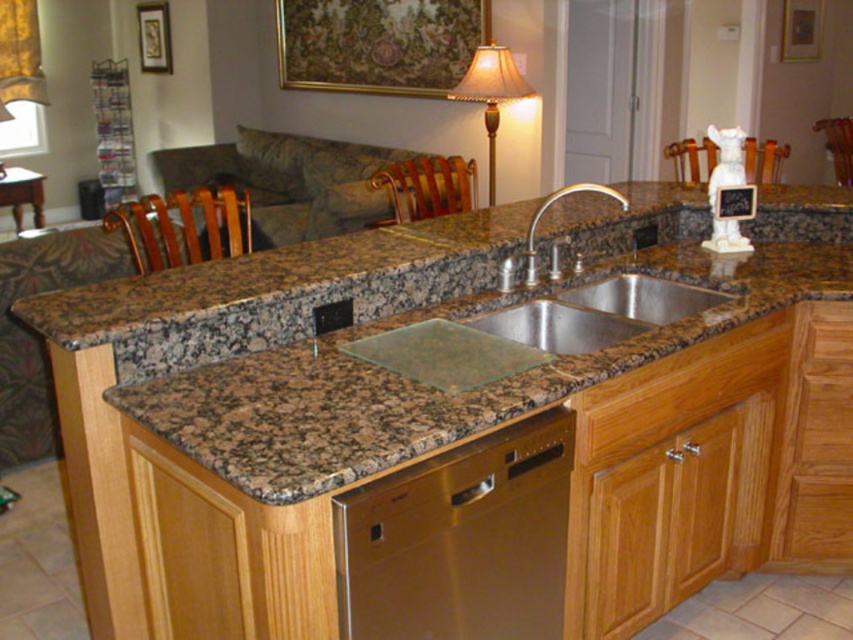
You are standing in the kitchen and want to reach both the stainless steel sink at center and the gold fabric lampshade at upper center. Which object will you need to move closer to first?

You will need to move closer to the stainless steel sink at center first because it is closer to you than the gold fabric lampshade at upper center.

You are standing in the kitchen and see the wooden chair at center and the gold fabric lampshade at upper center. Which object is nearer to you?

The wooden chair at center is closer to the viewer than the gold fabric lampshade at upper center.

You are a person who is 5 feet tall. You want to sit between the wooden chair at center and the wooden chair at left. Can you comfortably fit between them?

The wooden chair at center is 3.90 feet away from the wooden chair at left. Since you are 5 feet tall, the distance between the chairs is less than your height, so you might not be able to comfortably fit between them.